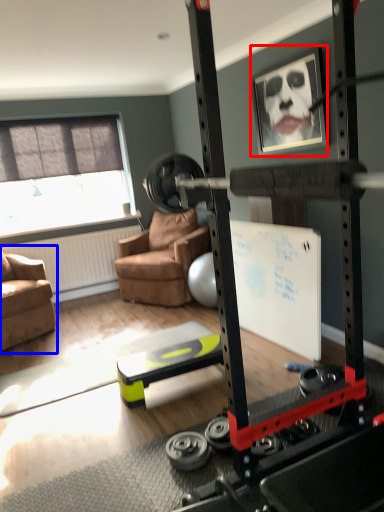
Question: Among these objects, which one is nearest to the camera, picture frame (highlighted by a red box) or chair (highlighted by a blue box)?

Choices:
 (A) picture frame
 (B) chair

Answer: (A)